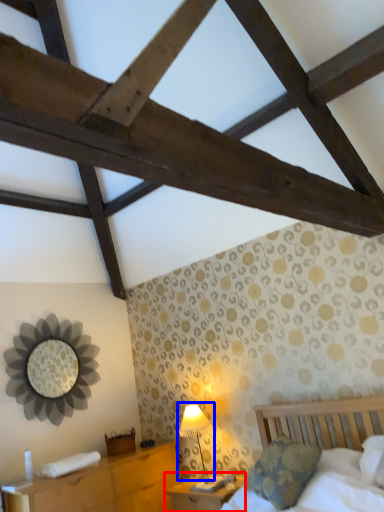
Question: Among these objects, which one is farthest to the camera, nightstand (highlighted by a red box) or table lamp (highlighted by a blue box)?

Choices:
 (A) nightstand
 (B) table lamp

Answer: (B)